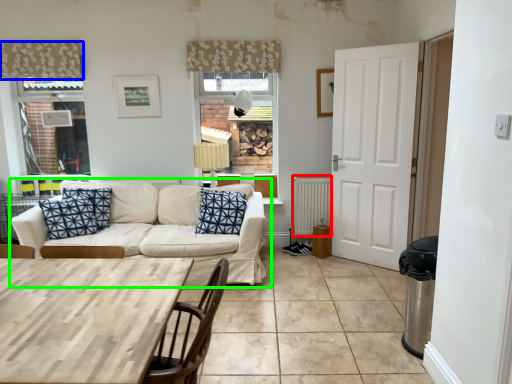
Question: Which object is positioned farthest from radiator (highlighted by a red box)? Select from curtain (highlighted by a blue box) and studio couch (highlighted by a green box).

Choices:
 (A) curtain
 (B) studio couch

Answer: (A)